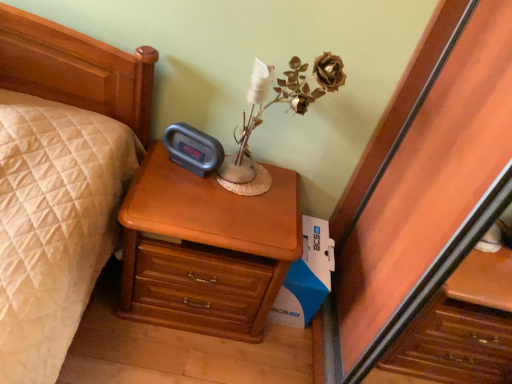
You are a GUI agent. You are given a task and a screenshot of the screen. Output one action in this format:
    pyautogui.click(x=<x>, y=<y>)
    Task: Click on the free space in front of light brown wood nightstand at center
    The image size is (512, 384).
    Given the screenshot: What is the action you would take?
    pyautogui.click(x=160, y=356)